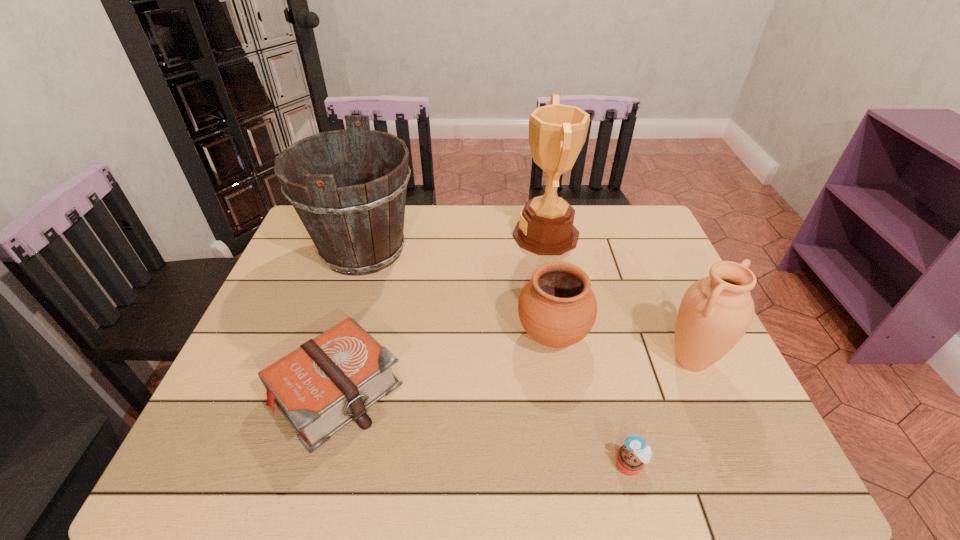
The height and width of the screenshot is (540, 960). I want to click on object positioned at the right edge, so click(716, 311).

This screenshot has width=960, height=540. In order to click on object positioned at the far left corner in this screenshot , I will do `click(357, 224)`.

You are a GUI agent. You are given a task and a screenshot of the screen. Output one action in this format:
    pyautogui.click(x=<x>, y=<y>)
    Task: Click on the object at the near left corner
    The image size is (960, 540).
    Given the screenshot: What is the action you would take?
    pyautogui.click(x=327, y=382)

What are the coordinates of `vacant space at the far edge` in the screenshot? It's located at (584, 210).

This screenshot has height=540, width=960. Identify the location of vacant space at the left edge of the desktop. (291, 282).

The height and width of the screenshot is (540, 960). I want to click on free location at the right edge of the desktop, so click(x=709, y=411).

Where is `free location at the far right corner`? This screenshot has height=540, width=960. free location at the far right corner is located at coordinates (645, 230).

At what (x,y) coordinates should I click in order to perform the action: click on vacant space at the near right corner of the desktop. Please return your answer as a coordinate pair (x, y). Image resolution: width=960 pixels, height=540 pixels. Looking at the image, I should click on (726, 474).

Identify the location of free space between the second tallest object and the shortest object. The image size is (960, 540). (497, 357).

I want to click on unoccupied area between the muffin and the award, so click(x=588, y=350).